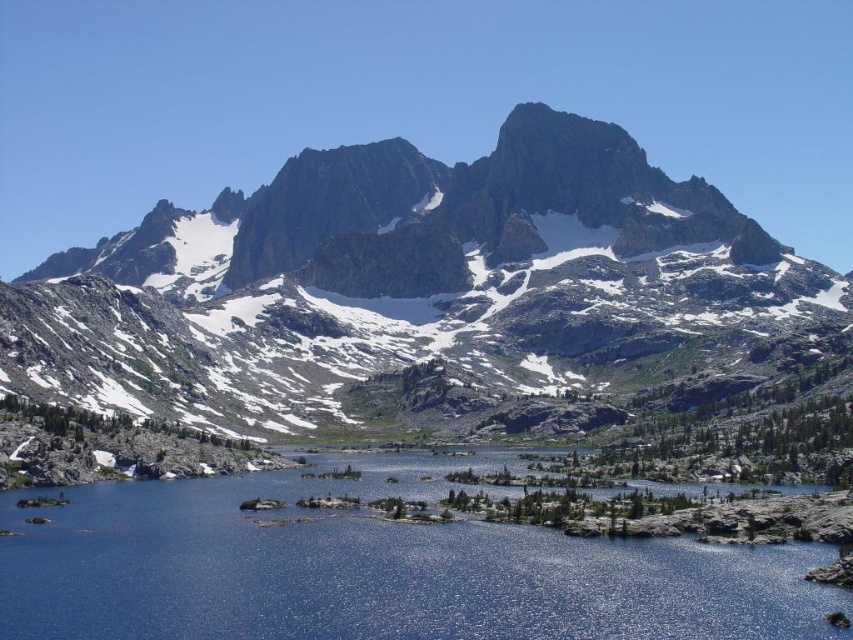
Question: Is the position of rocky gray mountain range at upper center less distant than that of blue reflective water at center?

Choices:
 (A) yes
 (B) no

Answer: (B)

Question: Does rocky gray mountain range at upper center have a lesser width compared to blue reflective water at center?

Choices:
 (A) no
 (B) yes

Answer: (A)

Question: Is rocky gray mountain range at upper center to the left of blue reflective water at center from the viewer's perspective?

Choices:
 (A) no
 (B) yes

Answer: (B)